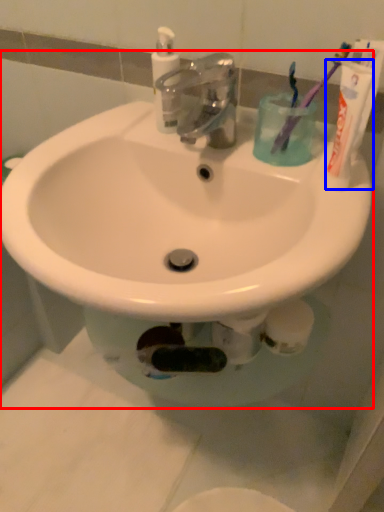
Question: Which object appears closest to the camera in this image, sink (highlighted by a red box) or toothpaste (highlighted by a blue box)?

Choices:
 (A) sink
 (B) toothpaste

Answer: (A)